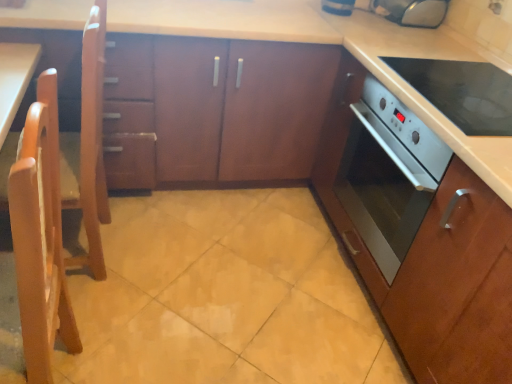
Question: Can satin wood oven at center, acting as the first cabinetry starting from the right, be found inside yellow matte tile at center?

Choices:
 (A) yes
 (B) no

Answer: (B)

Question: Does yellow matte tile at center have a smaller size compared to satin wood oven at center, marked as the second cabinetry in a left-to-right arrangement?

Choices:
 (A) no
 (B) yes

Answer: (B)

Question: Is yellow matte tile at center behind satin wood oven at center, marked as the second cabinetry in a left-to-right arrangement?

Choices:
 (A) no
 (B) yes

Answer: (B)

Question: Is yellow matte tile at center positioned beyond the bounds of satin wood oven at center, acting as the first cabinetry starting from the right?

Choices:
 (A) no
 (B) yes

Answer: (B)

Question: Is yellow matte tile at center thinner than satin wood oven at center, marked as the second cabinetry in a left-to-right arrangement?

Choices:
 (A) yes
 (B) no

Answer: (B)

Question: From the image's perspective, is blue glossy toaster at upper center, marked as the second appliance in a right-to-left arrangement, above or below yellow matte tile at center?

Choices:
 (A) below
 (B) above

Answer: (B)

Question: Looking at the image, does blue glossy toaster at upper center, marked as the second appliance in a right-to-left arrangement, seem bigger or smaller compared to yellow matte tile at center?

Choices:
 (A) small
 (B) big

Answer: (A)

Question: Do you think blue glossy toaster at upper center, which is counted as the 1th appliance, starting from the left, is within yellow matte tile at center, or outside of it?

Choices:
 (A) outside
 (B) inside

Answer: (A)

Question: From a real-world perspective, is blue glossy toaster at upper center, marked as the second appliance in a right-to-left arrangement, positioned above or below yellow matte tile at center?

Choices:
 (A) above
 (B) below

Answer: (A)

Question: Considering the positions of wooden cabinet at center, placed as the 1th cabinetry when sorted from left to right, and light wood chair at left, the second chair viewed from the back, in the image, is wooden cabinet at center, placed as the 1th cabinetry when sorted from left to right, wider or thinner than light wood chair at left, the second chair viewed from the back,?

Choices:
 (A) wide
 (B) thin

Answer: (A)

Question: In terms of height, does wooden cabinet at center, placed as the 1th cabinetry when sorted from left to right, look taller or shorter compared to light wood chair at left, the second chair viewed from the back?

Choices:
 (A) tall
 (B) short

Answer: (B)

Question: Based on their sizes in the image, would you say wooden cabinet at center, acting as the 2th cabinetry starting from the right, is bigger or smaller than light wood chair at left, the second chair viewed from the back?

Choices:
 (A) big
 (B) small

Answer: (A)

Question: Based on their positions, is wooden cabinet at center, placed as the 1th cabinetry when sorted from left to right, located to the left or right of light wood chair at left, the second chair viewed from the back?

Choices:
 (A) right
 (B) left

Answer: (A)

Question: From a real-world perspective, is wooden cabinet at center, placed as the 1th cabinetry when sorted from left to right, above or below satin wood oven at center, marked as the second cabinetry in a left-to-right arrangement?

Choices:
 (A) above
 (B) below

Answer: (A)

Question: Considering their positions, is wooden cabinet at center, placed as the 1th cabinetry when sorted from left to right, located in front of or behind satin wood oven at center, acting as the first cabinetry starting from the right?

Choices:
 (A) behind
 (B) front

Answer: (A)